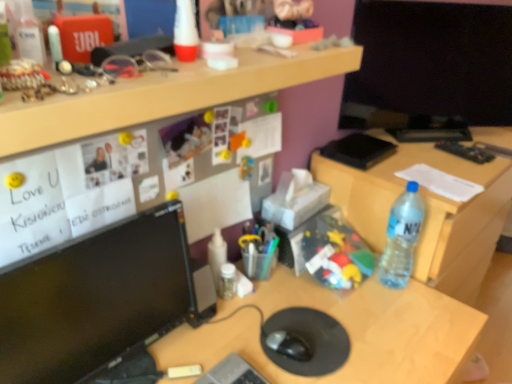
Locate an element on the screen. vacant space that is to the left of translucent plastic bottle at right, marked as the second bottle in a left-to-right arrangement is located at coordinates (350, 290).